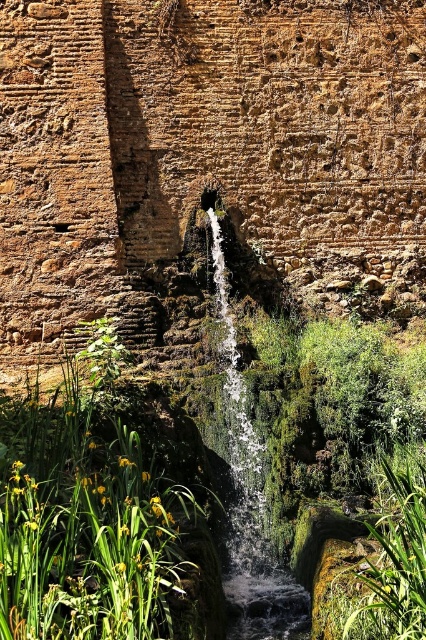
Who is positioned more to the left, green leafy plants at lower left or green leafy plant at lower right?

Positioned to the left is green leafy plants at lower left.

Who is shorter, green leafy plants at lower left or green leafy plant at lower right?

With less height is green leafy plant at lower right.

Does point (0, 630) come farther from viewer compared to point (356, 605)?

That is False.

I want to click on green leafy plants at lower left, so click(94, 529).

Does green leafy plants at lower left have a lesser width compared to clear water at center?

In fact, green leafy plants at lower left might be wider than clear water at center.

Measure the distance between green leafy plants at lower left and camera.

31.76 meters

Is point (77, 458) positioned after point (236, 544)?

No, it is in front of (236, 544).

This screenshot has height=640, width=426. In order to click on green leafy plants at lower left in this screenshot , I will do `click(94, 529)`.

Which of these two, clear water at center or green leafy plant at lower right, stands shorter?

Standing shorter between the two is green leafy plant at lower right.

Where is `clear water at center`? clear water at center is located at coordinates (250, 502).